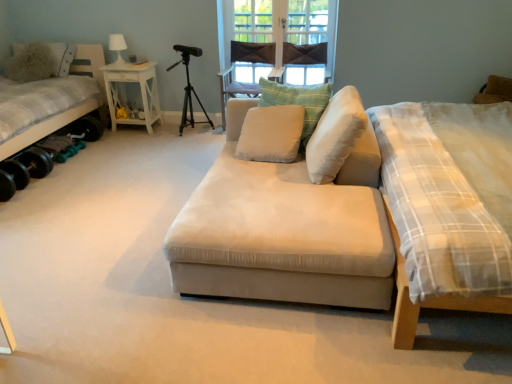
The width and height of the screenshot is (512, 384). I want to click on vacant space in front of white wood side table at left, so click(131, 142).